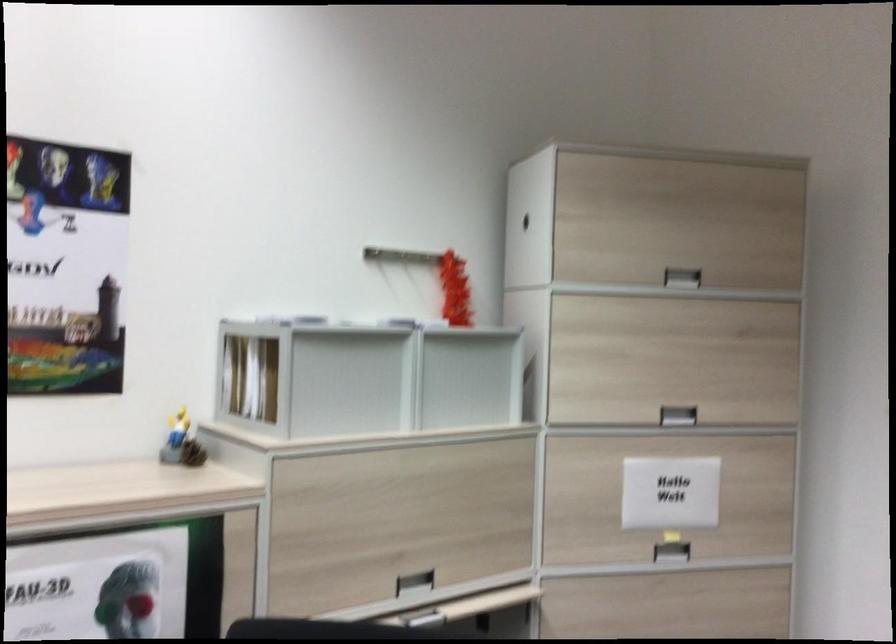
I want to click on small pinecone, so click(x=192, y=453).